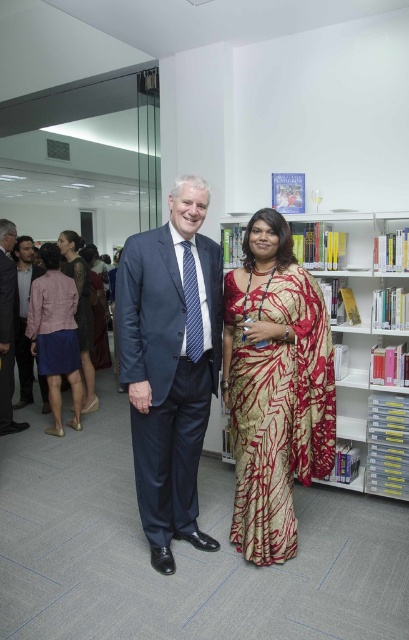
Looking at this image, you are a photographer standing in front of the two individuals wearing dark blue suit at left and dark gray suit at left. You want to take a photo of them but need to ensure there is enough space between them for a group shot. The minimum required distance for the photo is 15 inches. Can you fit them both in the frame comfortably?

The dark blue suit at left is 14.54 inches from dark gray suit at left. Since the required distance is 15 inches, they are slightly too close to meet the minimum requirement. You may need to ask them to move a little further apart to ensure proper framing.

You are organizing a fashion show and need to decide which outfit to display first. The pink fabric skirt at lower left and the matte pink dress at center are both options. Based on their sizes, which one should you choose if you want to start with the larger piece?

The pink fabric skirt at lower left is bigger than the matte pink dress at center, so you should choose the pink fabric skirt at lower left to display first.

You are an interior designer assessing the layout of this library. You notice the pink fabric skirt at lower left and the matte pink dress at center. Which of these two items has a shorter length?

The pink fabric skirt at lower left has a lesser height compared to the matte pink dress at center, so the pink fabric skirt at lower left is shorter in length.